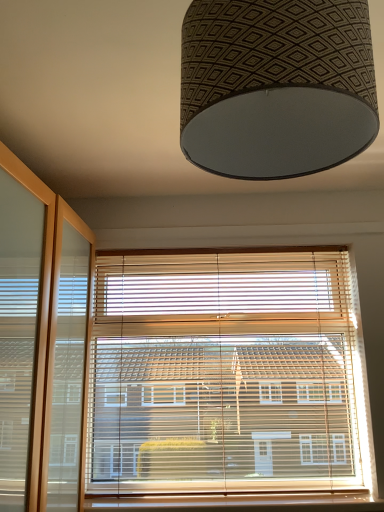
Question: Considering the relative positions of patterned fabric lampshade at upper center and wooden blinds at center in the image provided, is patterned fabric lampshade at upper center in front of wooden blinds at center?

Choices:
 (A) yes
 (B) no

Answer: (A)

Question: Considering the relative sizes of patterned fabric lampshade at upper center and wooden blinds at center in the image provided, is patterned fabric lampshade at upper center taller than wooden blinds at center?

Choices:
 (A) no
 (B) yes

Answer: (A)

Question: From a real-world perspective, is patterned fabric lampshade at upper center physically below wooden blinds at center?

Choices:
 (A) no
 (B) yes

Answer: (A)

Question: Does patterned fabric lampshade at upper center come behind wooden blinds at center?

Choices:
 (A) no
 (B) yes

Answer: (A)

Question: Is patterned fabric lampshade at upper center bigger than wooden blinds at center?

Choices:
 (A) no
 (B) yes

Answer: (A)

Question: From a real-world perspective, is patterned fabric lampshade at upper center positioned above or below wooden at lower center?

Choices:
 (A) below
 (B) above

Answer: (B)

Question: Is patterned fabric lampshade at upper center situated inside wooden at lower center or outside?

Choices:
 (A) inside
 (B) outside

Answer: (B)

Question: Visually, is patterned fabric lampshade at upper center positioned to the left or to the right of wooden at lower center?

Choices:
 (A) left
 (B) right

Answer: (A)

Question: Looking at the image, does patterned fabric lampshade at upper center seem bigger or smaller compared to wooden at lower center?

Choices:
 (A) big
 (B) small

Answer: (A)

Question: From the image's perspective, is wooden blinds at center located above or below wooden at lower center?

Choices:
 (A) below
 (B) above

Answer: (B)

Question: In terms of size, does wooden blinds at center appear bigger or smaller than wooden at lower center?

Choices:
 (A) big
 (B) small

Answer: (A)

Question: In terms of width, does wooden blinds at center look wider or thinner when compared to wooden at lower center?

Choices:
 (A) wide
 (B) thin

Answer: (B)

Question: Is wooden blinds at center inside or outside of wooden at lower center?

Choices:
 (A) outside
 (B) inside

Answer: (A)

Question: Does point (206, 310) appear closer or farther from the camera than point (359, 0)?

Choices:
 (A) farther
 (B) closer

Answer: (A)

Question: Considering the positions of wooden blinds at center and patterned fabric lampshade at upper center in the image, is wooden blinds at center taller or shorter than patterned fabric lampshade at upper center?

Choices:
 (A) short
 (B) tall

Answer: (B)